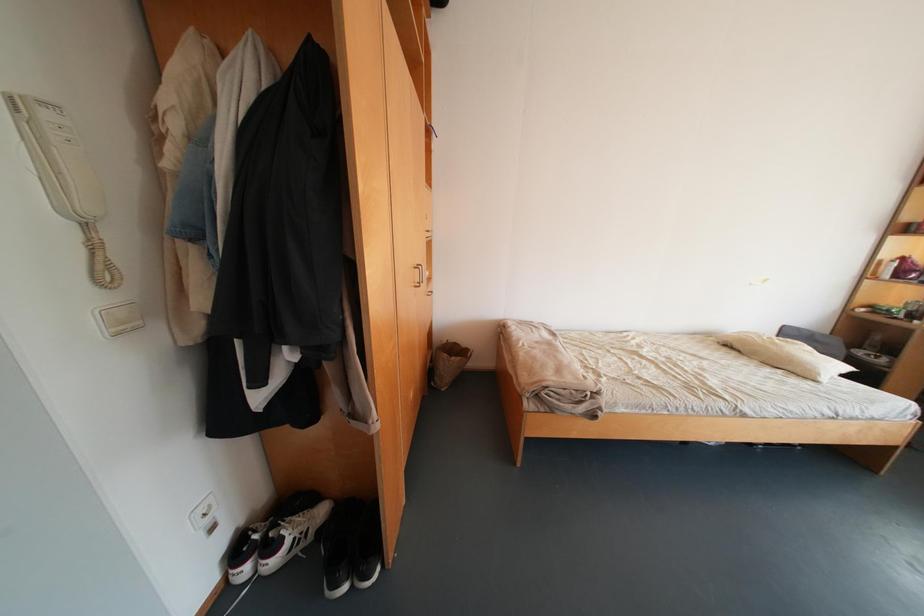
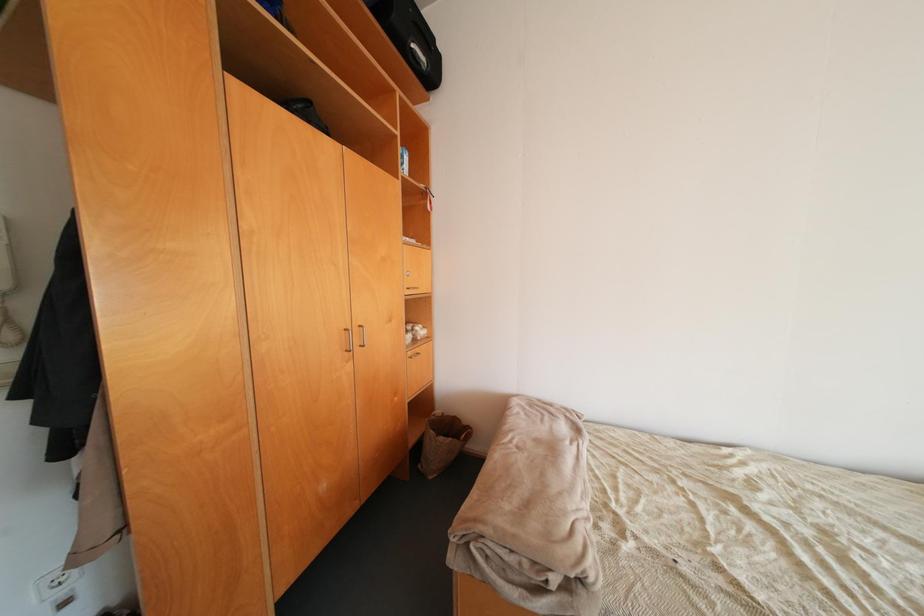
In a continuous first-person perspective shot, in which direction is the camera moving?

The cameraman walked toward right, forward.